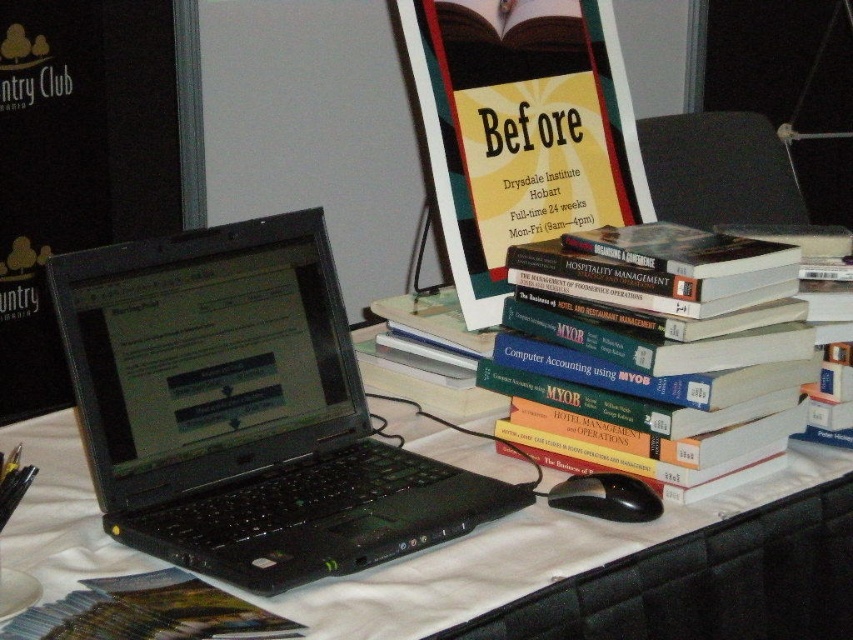
You are organizing the items on the table and need to place a 20 cm wide decorative plate between the black plastic laptop at center and the green matte book at lower left. Can you fit it without moving either item?

The distance between the black plastic laptop at center and the green matte book at lower left is 19.57 centimeters. Since the plate is 20 cm wide, it cannot fit in the space between them without moving either item.